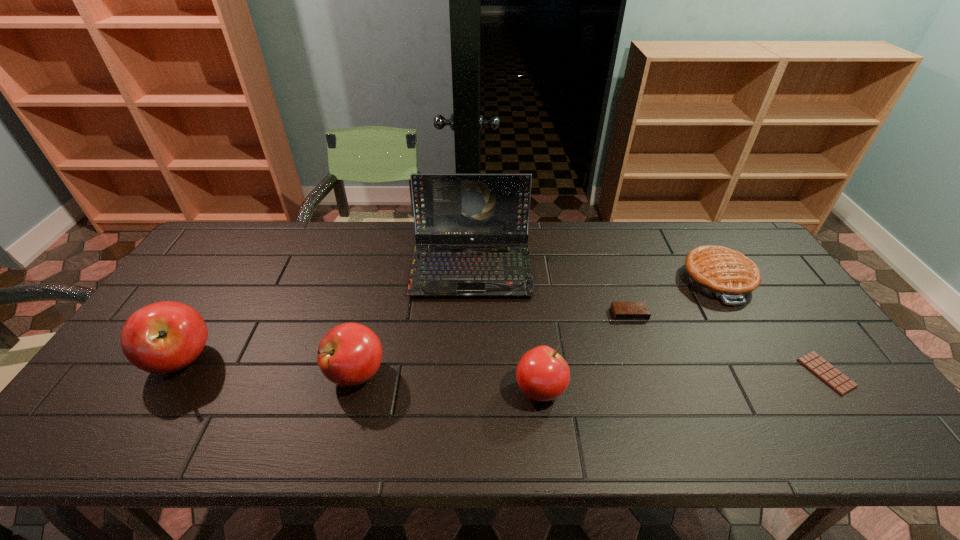
The width and height of the screenshot is (960, 540). I want to click on vacant space at the far left corner, so click(x=245, y=242).

The width and height of the screenshot is (960, 540). In order to click on vacant space at the far right corner of the desktop in this screenshot , I will do `click(725, 245)`.

Locate an element on the screen. The width and height of the screenshot is (960, 540). vacant area between the candy bar and the leftmost apple is located at coordinates (504, 366).

Image resolution: width=960 pixels, height=540 pixels. What are the coordinates of `unoccupied area between the leftmost object and the candy bar` in the screenshot? It's located at (504, 366).

Image resolution: width=960 pixels, height=540 pixels. What are the coordinates of `unoccupied area between the third shortest object and the second apple from left to right` in the screenshot? It's located at (537, 327).

I want to click on vacant region between the sixth tallest object and the fifth tallest object, so click(x=673, y=296).

Where is `unoccupied position between the fifth object from left to right and the candy bar`? The width and height of the screenshot is (960, 540). unoccupied position between the fifth object from left to right and the candy bar is located at coordinates (728, 343).

Locate an element on the screen. free space between the pie and the second tallest apple is located at coordinates (537, 327).

Where is `vacant space that is in between the third shortest object and the second apple from left to right`? This screenshot has height=540, width=960. vacant space that is in between the third shortest object and the second apple from left to right is located at coordinates (537, 327).

At what (x,y) coordinates should I click in order to perform the action: click on free space between the fifth tallest object and the tallest object. Please return your answer as a coordinate pair (x, y). The width and height of the screenshot is (960, 540). Looking at the image, I should click on (594, 273).